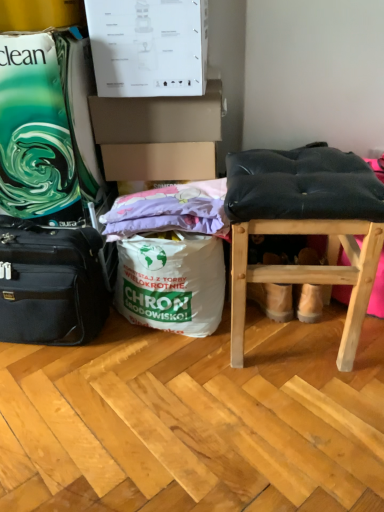
Question: Relative to black fabric suitcase at left, is white paper bag at center in front or behind?

Choices:
 (A) front
 (B) behind

Answer: (B)

Question: Is white paper bag at center inside or outside of black fabric suitcase at left?

Choices:
 (A) outside
 (B) inside

Answer: (A)

Question: Estimate the real-world distances between objects in this image. Which object is closer to the black fabric suitcase at left?

Choices:
 (A) black leather stool at right
 (B) white paper bag at center
 (C) purple fabric at center

Answer: (B)

Question: Estimate the real-world distances between objects in this image. Which object is farther from the black fabric suitcase at left?

Choices:
 (A) black leather stool at right
 (B) purple fabric at center
 (C) white paper bag at center

Answer: (A)